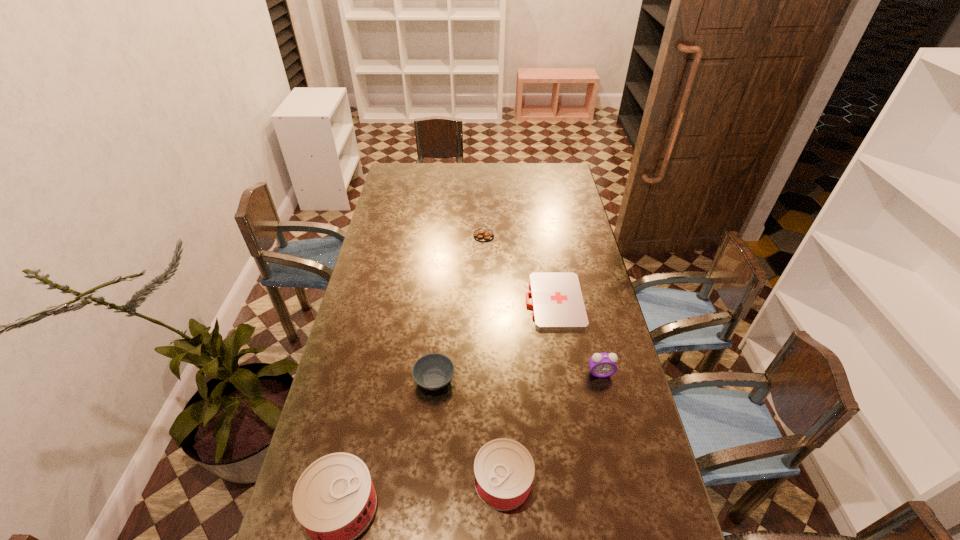
This screenshot has height=540, width=960. Find the location of `vacant space situated 0.100m on the left of the pastry`. vacant space situated 0.100m on the left of the pastry is located at coordinates (450, 235).

Find the location of a particular element. The height and width of the screenshot is (540, 960). free space located on the left of the third shortest object is located at coordinates (397, 379).

At what (x,y) coordinates should I click in order to perform the action: click on vacant space located 0.130m on handle side the shortest object. Please return your answer as a coordinate pair (x, y). This screenshot has width=960, height=540. Looking at the image, I should click on click(491, 301).

You are a GUI agent. You are given a task and a screenshot of the screen. Output one action in this format:
    pyautogui.click(x=<x>, y=<y>)
    Task: Click on the free space located on handle side the shortest object
    
    Given the screenshot: What is the action you would take?
    pyautogui.click(x=471, y=301)

Locate an element on the screen. blank space located 0.210m on handle side the shortest object is located at coordinates (468, 301).

Identify the location of object at the near edge. The image size is (960, 540). (504, 469).

In order to click on alarm clock that is at the right edge in this screenshot , I will do `click(602, 365)`.

Identify the location of the first-aid kit located in the right edge section of the desktop. (557, 301).

Identify the location of vacant area at the far edge. This screenshot has width=960, height=540. (524, 187).

The height and width of the screenshot is (540, 960). In the image, there is a desktop. Identify the location of vacant space at the near edge. (375, 526).